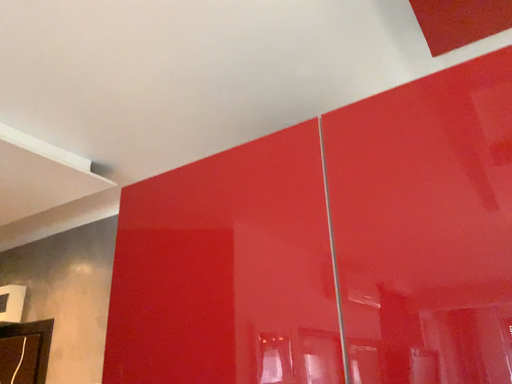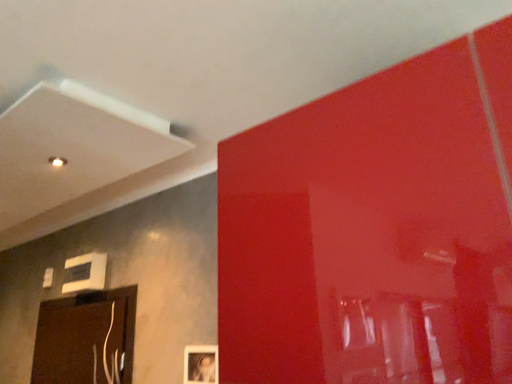
Question: How did the camera likely rotate when shooting the video?

Choices:
 (A) rotated left
 (B) rotated right

Answer: (A)